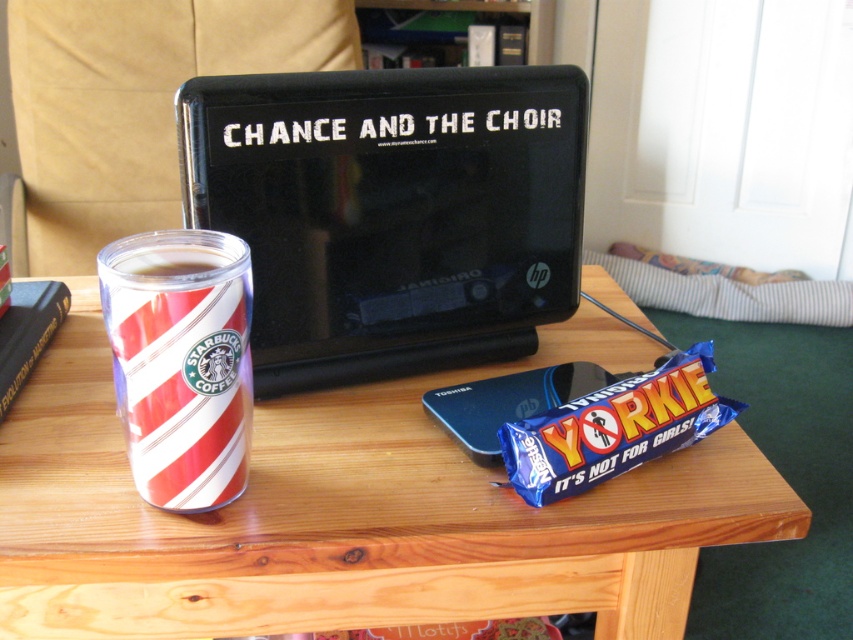
Can you confirm if wooden table at center is taller than black matte laptop at center?

Yes, wooden table at center is taller than black matte laptop at center.

Is wooden table at center to the right of black matte laptop at center from the viewer's perspective?

Incorrect, wooden table at center is not on the right side of black matte laptop at center.

The image size is (853, 640). What are the coordinates of `wooden table at center` in the screenshot? It's located at (352, 513).

Does wooden table at center appear over blue foil yorkie bar at lower right?

No, wooden table at center is not above blue foil yorkie bar at lower right.

Which is below, wooden table at center or blue foil yorkie bar at lower right?

wooden table at center is below.

Image resolution: width=853 pixels, height=640 pixels. What do you see at coordinates (352, 513) in the screenshot? I see `wooden table at center` at bounding box center [352, 513].

Where is `wooden table at center`? wooden table at center is located at coordinates (352, 513).

Is black matte laptop at center further to the viewer compared to blue foil yorkie bar at lower right?

Yes, it is behind blue foil yorkie bar at lower right.

Find the location of a particular element. black matte laptop at center is located at coordinates (392, 211).